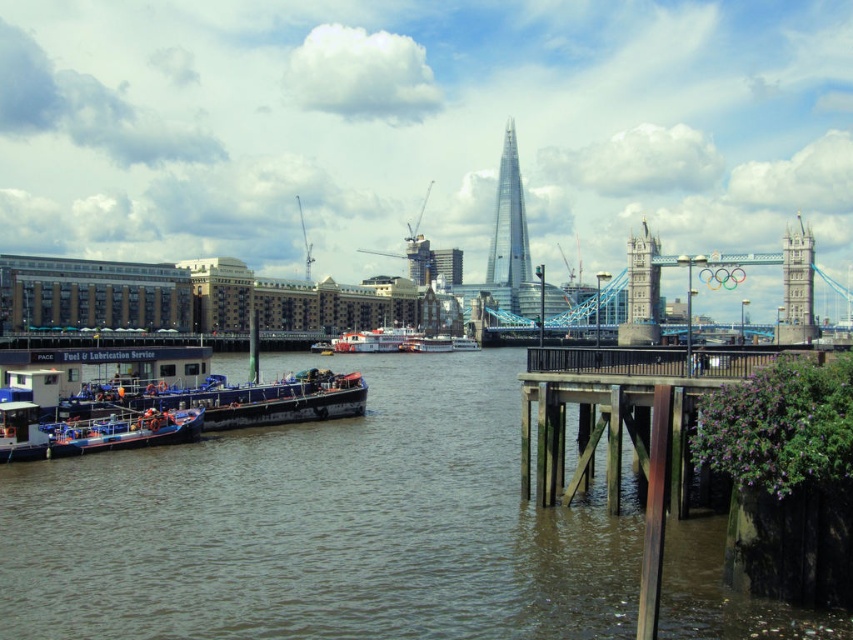
You are an architect designing a new building that needs to be taller than the brown water at lower left but shorter than the glassy steel skyscraper at center. Can you build such a structure based on the scene?

The brown water at lower left is smaller than the glassy steel skyscraper at center. Since the brown water at lower left is smaller, you can build a structure taller than it but shorter than the skyscraper.

You are a photographer standing on the dock and want to capture both the brown water at lower left and the glassy steel skyscraper at center in the same frame. Which object will appear taller in your photo?

The glassy steel skyscraper at center will appear taller in the photo because it is taller than the brown water at lower left.